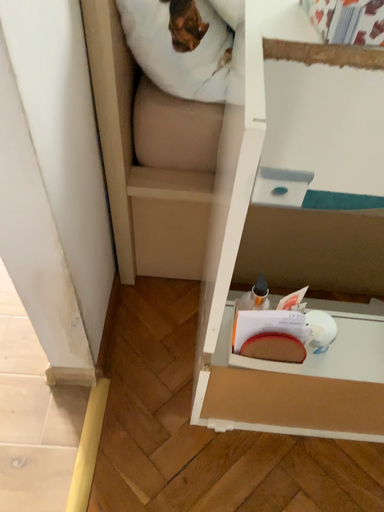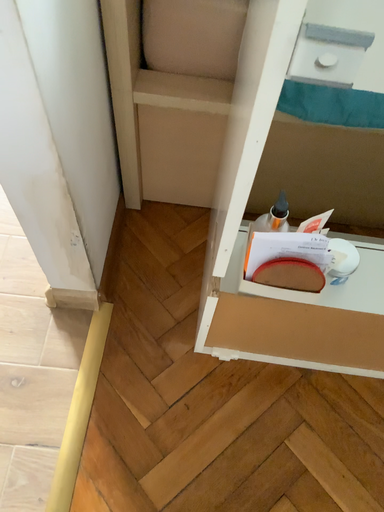
Question: Which way did the camera rotate in the video?

Choices:
 (A) rotated downward
 (B) rotated upward

Answer: (A)